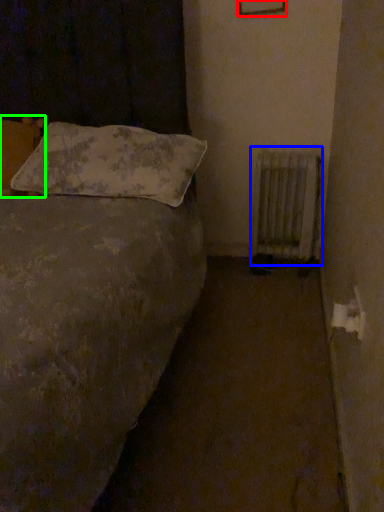
Question: Considering the real-world distances, which object is farthest from picture frame (highlighted by a red box)? radiator (highlighted by a blue box) or pillow (highlighted by a green box)?

Choices:
 (A) radiator
 (B) pillow

Answer: (B)